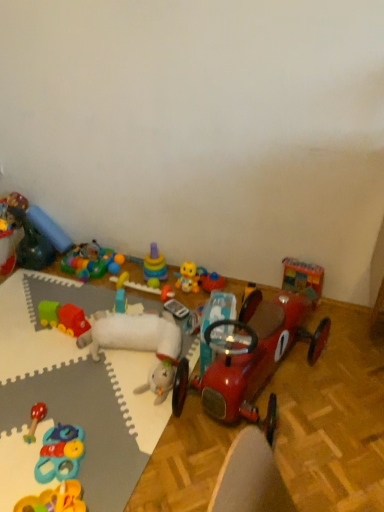
Question: Is rubberized plastic rings at center, which is counted as the fourth toy, starting from the right, not inside yellow rubber duck at center, which ranks as the tenth toy in left-to-right order?

Choices:
 (A) yes
 (B) no

Answer: (A)

Question: Is rubberized plastic rings at center, the 9th toy viewed from the left, next to yellow rubber duck at center, which is the third toy from right to left, and touching it?

Choices:
 (A) no
 (B) yes

Answer: (A)

Question: Does rubberized plastic rings at center, the 9th toy viewed from the left, lie in front of yellow rubber duck at center, which ranks as the tenth toy in left-to-right order?

Choices:
 (A) yes
 (B) no

Answer: (A)

Question: Does rubberized plastic rings at center, which is counted as the fourth toy, starting from the right, have a larger size compared to yellow rubber duck at center, which ranks as the tenth toy in left-to-right order?

Choices:
 (A) yes
 (B) no

Answer: (A)

Question: From a real-world perspective, is rubberized plastic rings at center, the 9th toy viewed from the left, beneath yellow rubber duck at center, which ranks as the tenth toy in left-to-right order?

Choices:
 (A) no
 (B) yes

Answer: (B)

Question: From the image's perspective, relative to rubberized plastic toy at lower left, placed as the 7th toy when sorted from left to right, is rubberized plastic rings at center, the 9th toy viewed from the left, above or below?

Choices:
 (A) above
 (B) below

Answer: (A)

Question: Considering the positions of rubberized plastic rings at center, the 9th toy viewed from the left, and rubberized plastic toy at lower left, marked as the sixth toy in a right-to-left arrangement, in the image, is rubberized plastic rings at center, the 9th toy viewed from the left, bigger or smaller than rubberized plastic toy at lower left, marked as the sixth toy in a right-to-left arrangement,?

Choices:
 (A) big
 (B) small

Answer: (A)

Question: Based on their positions, is rubberized plastic rings at center, which is counted as the fourth toy, starting from the right, located to the left or right of rubberized plastic toy at lower left, marked as the sixth toy in a right-to-left arrangement?

Choices:
 (A) right
 (B) left

Answer: (A)

Question: Is rubberized plastic rings at center, the 9th toy viewed from the left, wider or thinner than rubberized plastic toy at lower left, placed as the 7th toy when sorted from left to right?

Choices:
 (A) wide
 (B) thin

Answer: (B)

Question: Do you think rubber green and red train at lower left, positioned as the ninth toy in right-to-left order, is within rubber duck at upper left, the second toy when ordered from left to right, or outside of it?

Choices:
 (A) outside
 (B) inside

Answer: (A)

Question: Is rubber green and red train at lower left, marked as the 4th toy in a left-to-right arrangement, bigger or smaller than rubber duck at upper left, the 11th toy from the right?

Choices:
 (A) big
 (B) small

Answer: (B)

Question: Considering the positions of rubber green and red train at lower left, marked as the 4th toy in a left-to-right arrangement, and rubber duck at upper left, the second toy when ordered from left to right, in the image, is rubber green and red train at lower left, marked as the 4th toy in a left-to-right arrangement, wider or thinner than rubber duck at upper left, the second toy when ordered from left to right,?

Choices:
 (A) wide
 (B) thin

Answer: (A)

Question: Based on their positions, is rubber green and red train at lower left, positioned as the ninth toy in right-to-left order, located to the left or right of rubber duck at upper left, the second toy when ordered from left to right?

Choices:
 (A) left
 (B) right

Answer: (B)

Question: Is yellow rubber duck at center, which is the third toy from right to left, wider or thinner than blue fabric pillow at upper left, the tenth toy positioned from the right?

Choices:
 (A) wide
 (B) thin

Answer: (B)

Question: Is point (192, 281) positioned closer to the camera than point (59, 240)?

Choices:
 (A) farther
 (B) closer

Answer: (B)